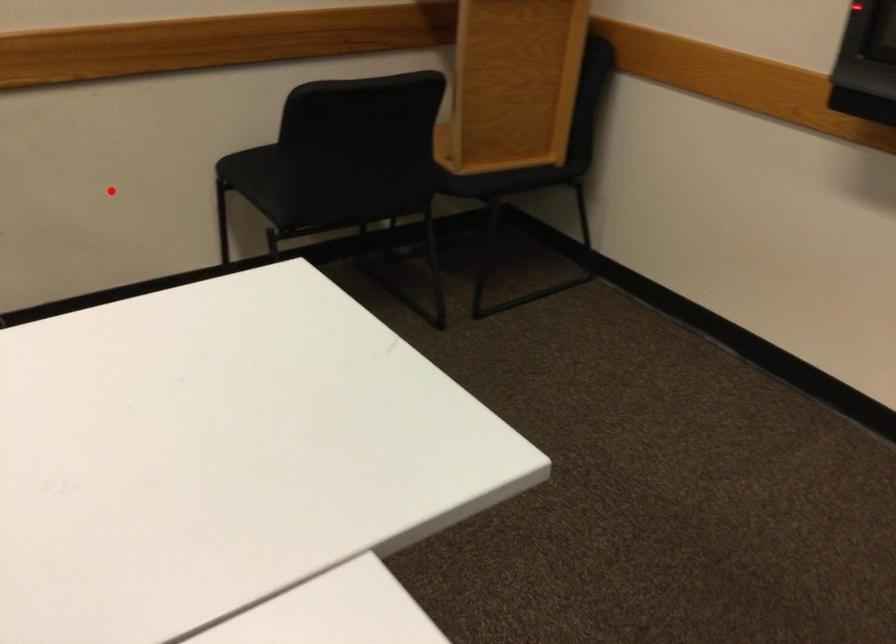
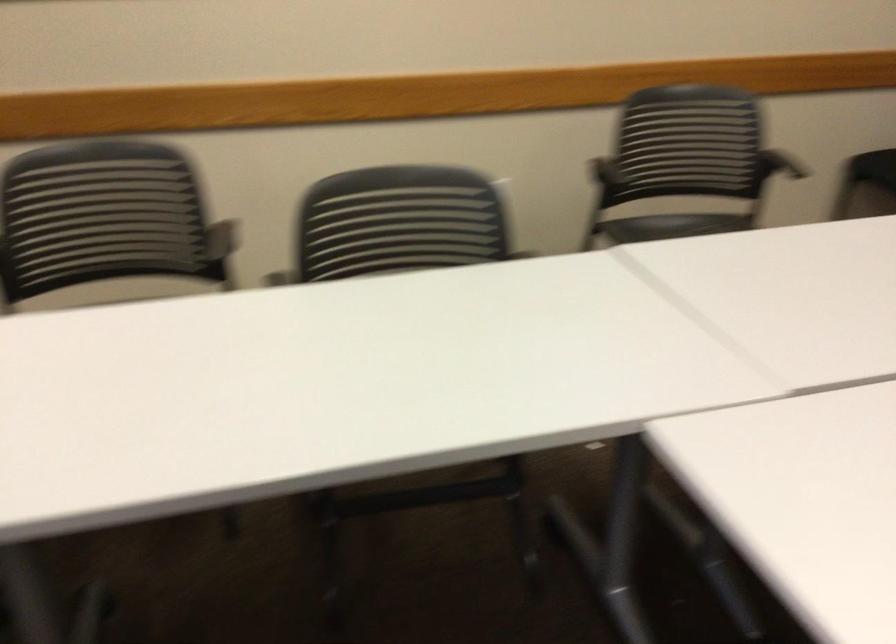
Question: A red point is marked in image1. In image2, is the corresponding 3D point closer to the camera or farther? Reply with the corresponding letter.

Choices:
 (A) The corresponding 3D point is closer.
 (B) The corresponding 3D point is farther.

Answer: (B)